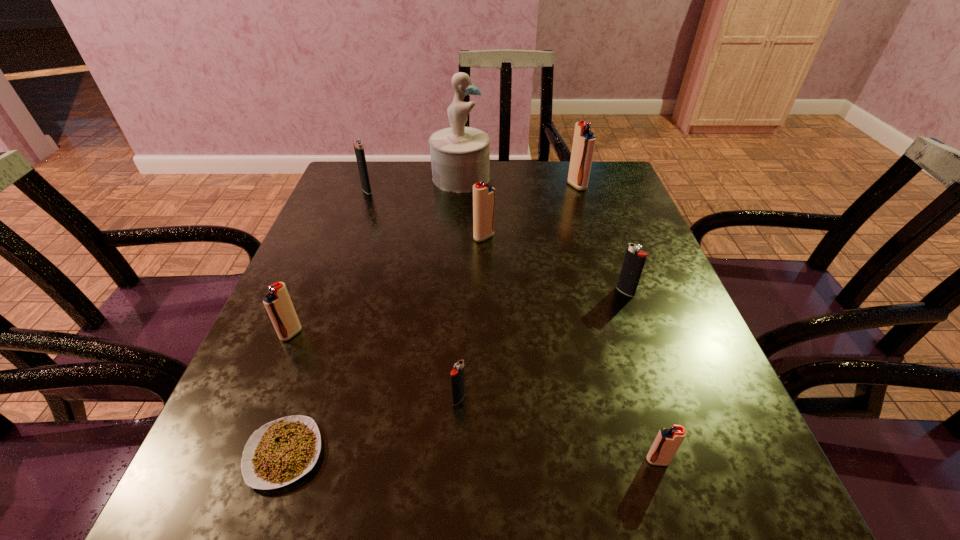
Where is `the tallest object`? This screenshot has width=960, height=540. the tallest object is located at coordinates (460, 156).

Identify the location of figurine. Image resolution: width=960 pixels, height=540 pixels. (460, 156).

The height and width of the screenshot is (540, 960). Find the location of `the tallest igniter`. the tallest igniter is located at coordinates (584, 140).

At what (x,y) coordinates should I click in order to perform the action: click on the eighth shortest object. Please return your answer as a coordinate pair (x, y). Looking at the image, I should click on (584, 140).

Where is `the fourth igniter from right to left`? the fourth igniter from right to left is located at coordinates (483, 193).

Locate an element on the screen. The height and width of the screenshot is (540, 960). the second farthest red igniter is located at coordinates (483, 193).

Where is `the biggest black igniter`? This screenshot has height=540, width=960. the biggest black igniter is located at coordinates (358, 144).

At what (x,y) coordinates should I click in order to perform the action: click on the farthest black igniter. Please return your answer as a coordinate pair (x, y). The width and height of the screenshot is (960, 540). Looking at the image, I should click on (358, 144).

The width and height of the screenshot is (960, 540). Identify the location of the second biggest black igniter. (634, 260).

Find the location of a particular element. the fourth nearest igniter is located at coordinates (634, 260).